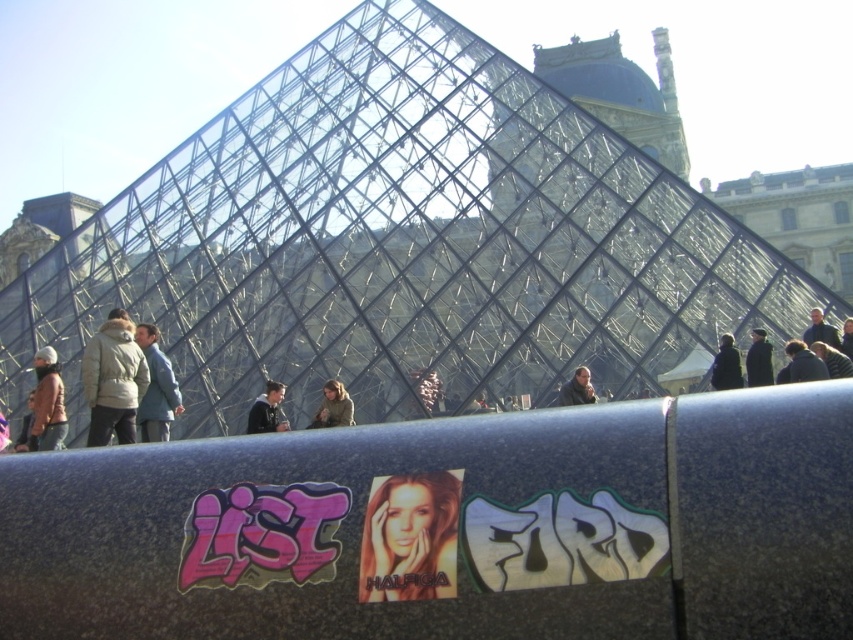
You are standing in front of the large glass pyramid structure at the museum. You notice a dark blue jacket at right. Where exactly is the dark blue jacket located in relation to the pyramid?

The dark blue jacket at right is located at point 0.570 on the x axis and 0.940 on the y axis relative to the pyramid structure.